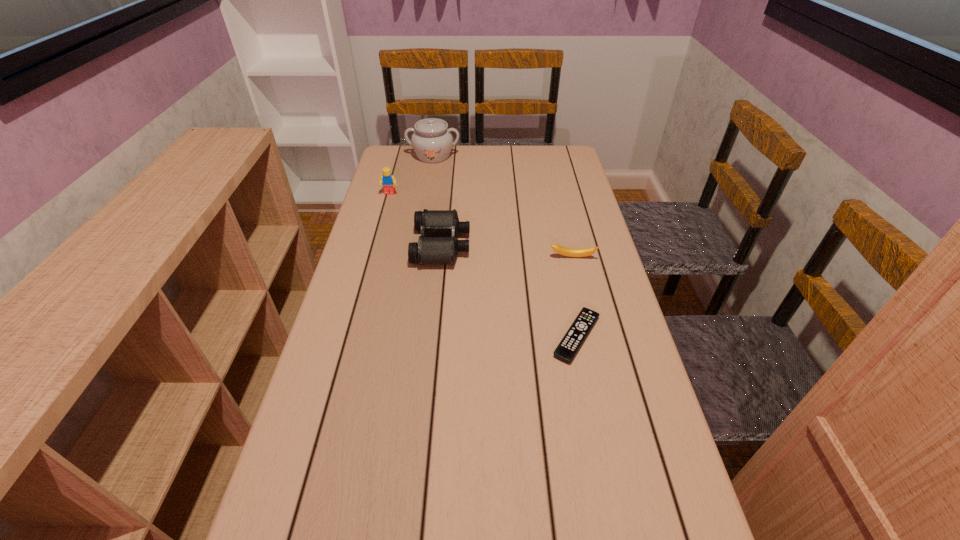
This screenshot has width=960, height=540. Find the location of `free region at the left edge`. free region at the left edge is located at coordinates (332, 517).

Locate an element on the screen. Image resolution: width=960 pixels, height=540 pixels. vacant region at the right edge of the desktop is located at coordinates pos(683,539).

At what (x,y) coordinates should I click in order to perform the action: click on vacant space in between the third tallest object and the shortest object. Please return your answer as a coordinate pair (x, y). This screenshot has height=540, width=960. Looking at the image, I should click on (509, 291).

You are a GUI agent. You are given a task and a screenshot of the screen. Output one action in this format:
    pyautogui.click(x=<x>, y=<y>)
    Task: Click on the free space between the remote control and the banana
    Image resolution: width=960 pixels, height=540 pixels.
    Given the screenshot: What is the action you would take?
    pyautogui.click(x=575, y=297)

This screenshot has width=960, height=540. I want to click on free spot between the chinaware and the binoculars, so click(438, 200).

Where is `unoccupied area between the third shortest object and the tallest object`? unoccupied area between the third shortest object and the tallest object is located at coordinates (438, 200).

What are the coordinates of `vacant point located between the third tallest object and the remote control` in the screenshot? It's located at (509, 291).

Where is `empty space that is in between the binoculars and the banana`? empty space that is in between the binoculars and the banana is located at coordinates (507, 251).

I want to click on vacant space that's between the binoculars and the remote control, so click(x=509, y=291).

Where is `free space between the nearest object and the banana`? This screenshot has height=540, width=960. free space between the nearest object and the banana is located at coordinates (575, 297).